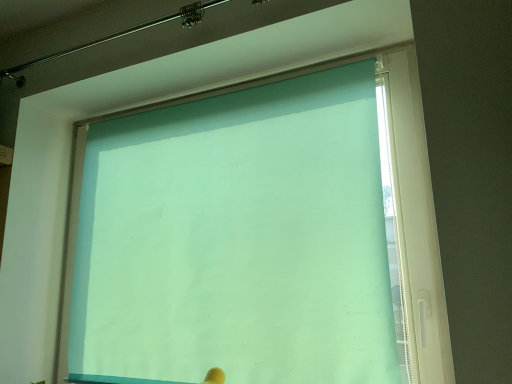
Question: Should I look upward or downward to see teal matte window at upper center?

Choices:
 (A) down
 (B) up

Answer: (A)